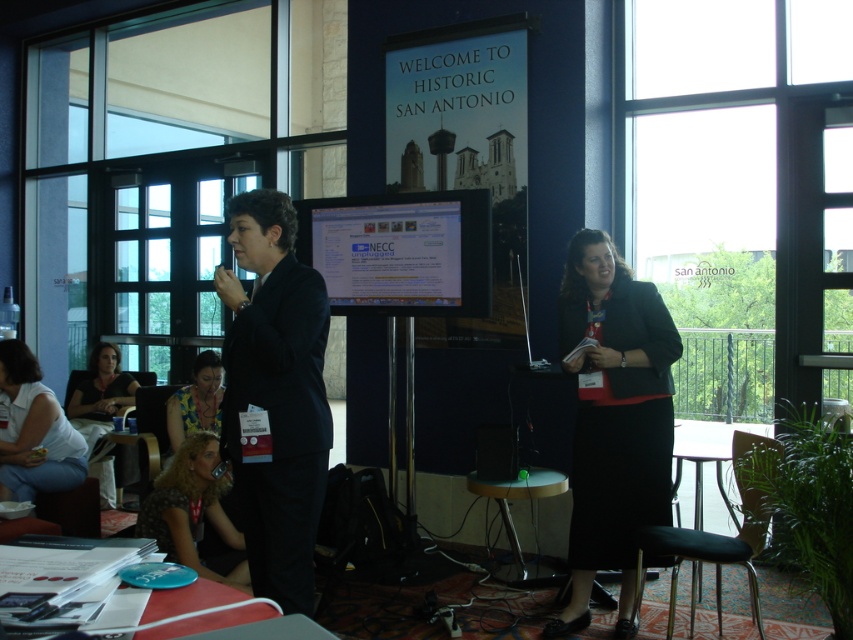
Question: Is black fabric skirt at right closer to the viewer compared to dark brown hair at lower center?

Choices:
 (A) no
 (B) yes

Answer: (A)

Question: Which of the following is the closest to the observer?

Choices:
 (A) white fabric shirt at lower left
 (B) matte black shirt at lower left

Answer: (A)

Question: Does black suit at center appear on the left side of matte black shirt at lower left?

Choices:
 (A) yes
 (B) no

Answer: (B)

Question: Which object appears closest to the camera in this image?

Choices:
 (A) matte black shirt at lower left
 (B) white fabric shirt at lower left

Answer: (B)

Question: In this image, where is black suit at center located relative to dark brown hair at lower center?

Choices:
 (A) below
 (B) above

Answer: (B)

Question: Which point is closer to the camera?

Choices:
 (A) (30, 368)
 (B) (311, 369)
 (C) (630, 467)
 (D) (198, 429)

Answer: (B)